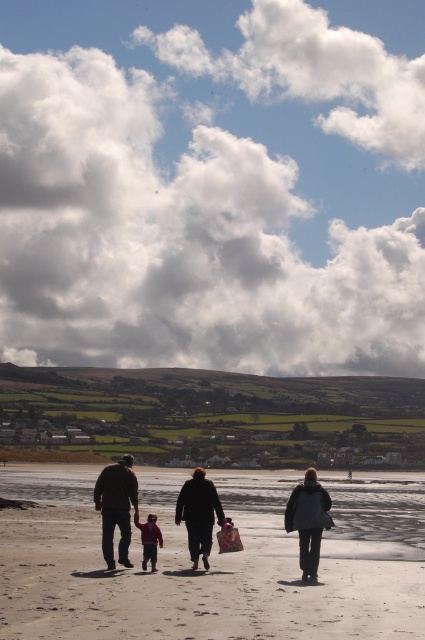
Between point (258, 515) and point (121, 547), which one is positioned in front?

Point (121, 547) is in front.

Does light brown sand at center appear over brown leather jacket at lower left?

No.

Does point (14, 630) lie in front of point (110, 554)?

That is True.

Find the location of a particular element. light brown sand at center is located at coordinates (201, 584).

Does dark gray coat at center appear under brown leather jacket at lower left?

Yes.

Between dark gray coat at center and brown leather jacket at lower left, which one has more height?

With more height is dark gray coat at center.

Is point (127, 536) positioned in front of point (99, 493)?

Yes, it is in front of point (99, 493).

This screenshot has height=640, width=425. I want to click on dark gray coat at center, so click(x=118, y=508).

Does brown leather jacket at lower left appear on the right side of matte red sweater at center?

No, brown leather jacket at lower left is not to the right of matte red sweater at center.

Is brown leather jacket at lower left below matte red sweater at center?

Correct, brown leather jacket at lower left is located below matte red sweater at center.

Find the location of `brown leather jacket at lower left`. brown leather jacket at lower left is located at coordinates (116, 508).